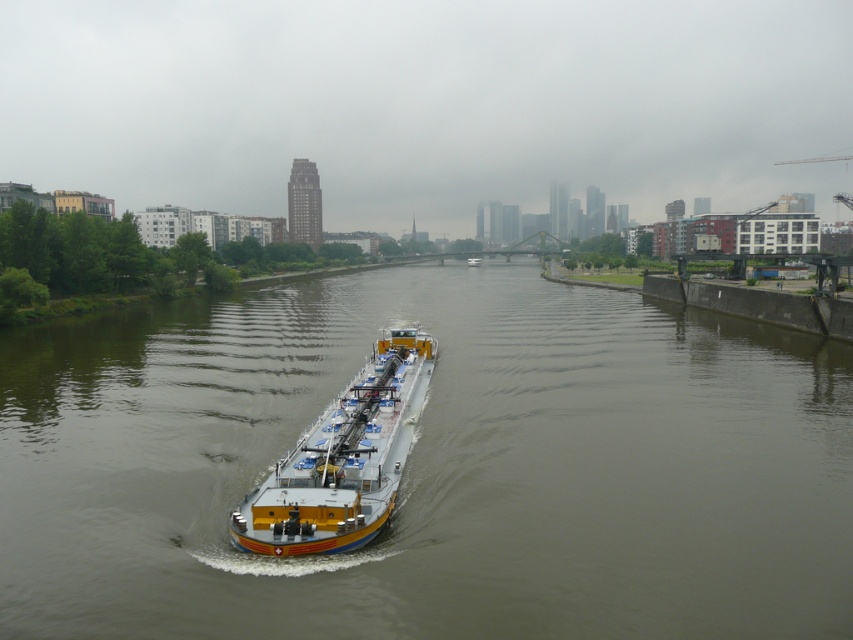
Does smooth concrete river at center have a greater width compared to yellow matte barge at center?

Yes, smooth concrete river at center is wider than yellow matte barge at center.

Between smooth concrete river at center and yellow matte barge at center, which one has more height?

With more height is smooth concrete river at center.

Find the location of a particular element. The image size is (853, 640). smooth concrete river at center is located at coordinates (432, 467).

Between point (328, 484) and point (471, 266), which one is positioned in front?

Point (328, 484) is in front.

Which is more to the left, yellow metallic barge at center or yellow matte barge at center?

From the viewer's perspective, yellow metallic barge at center appears more on the left side.

Measure the distance between yellow metallic barge at center and camera.

They are 50.04 feet apart.

I want to click on yellow metallic barge at center, so click(343, 458).

Who is positioned more to the right, smooth concrete river at center or yellow metallic barge at center?

smooth concrete river at center

Is point (419, 572) closer to viewer compared to point (367, 401)?

Yes, point (419, 572) is in front of point (367, 401).

This screenshot has height=640, width=853. What are the coordinates of `smooth concrete river at center` in the screenshot? It's located at (432, 467).